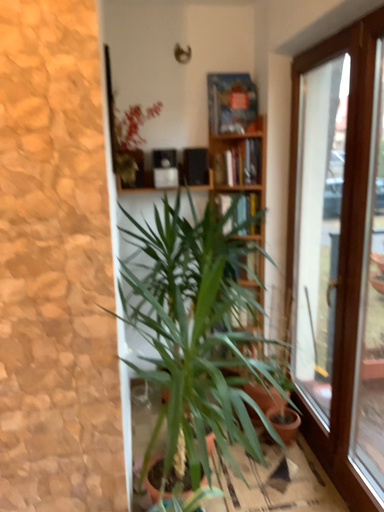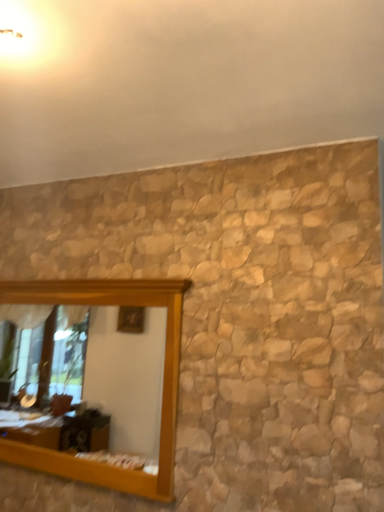
Question: How did the camera likely rotate when shooting the video?

Choices:
 (A) rotated downward
 (B) rotated upward

Answer: (B)